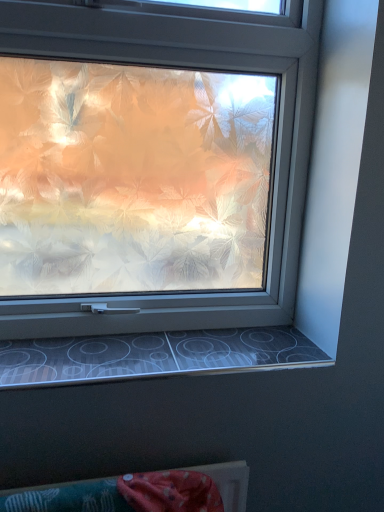
Locate an element on the screen. This screenshot has height=512, width=384. vacant space situated above dark gray textured mat at bottom (from a real-world perspective) is located at coordinates tap(158, 352).